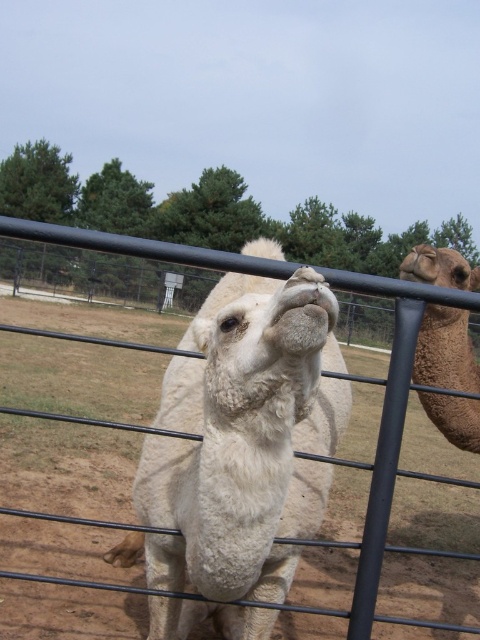
Question: Which object is closer to the camera taking this photo?

Choices:
 (A) brown fuzzy camel at right
 (B) white woolen camel at center
 (C) black metal fence at center

Answer: (B)

Question: Is white woolen camel at center thinner than brown fuzzy camel at right?

Choices:
 (A) no
 (B) yes

Answer: (A)

Question: Does white woolen camel at center come in front of black metal fence at center?

Choices:
 (A) yes
 (B) no

Answer: (A)

Question: Which point is farther to the camera?

Choices:
 (A) brown fuzzy camel at right
 (B) white woolen camel at center
 (C) black metal fence at center

Answer: (A)

Question: Can you confirm if white woolen camel at center is positioned above black metal fence at center?

Choices:
 (A) yes
 (B) no

Answer: (B)

Question: Which object is positioned farthest from the brown fuzzy camel at right?

Choices:
 (A) white woolen camel at center
 (B) black metal fence at center

Answer: (A)